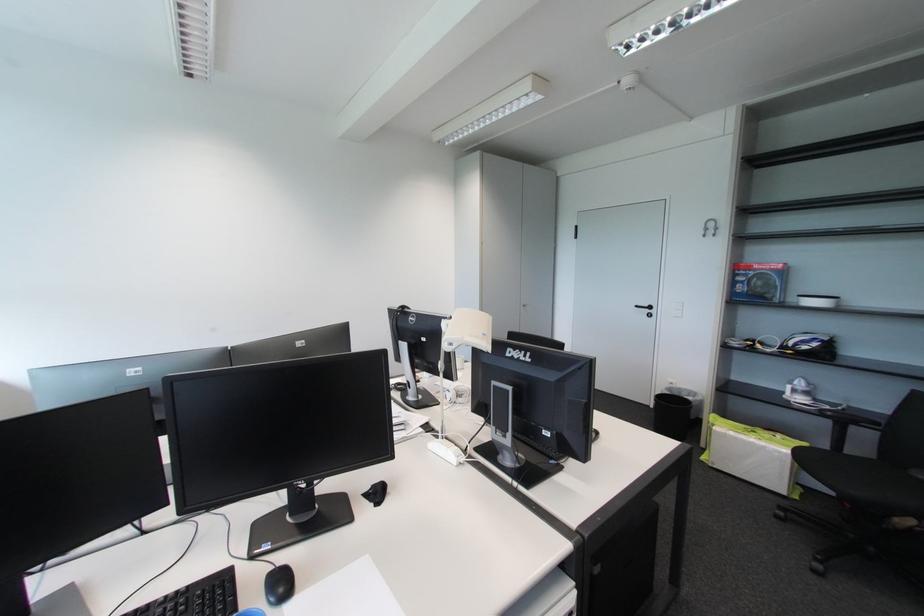
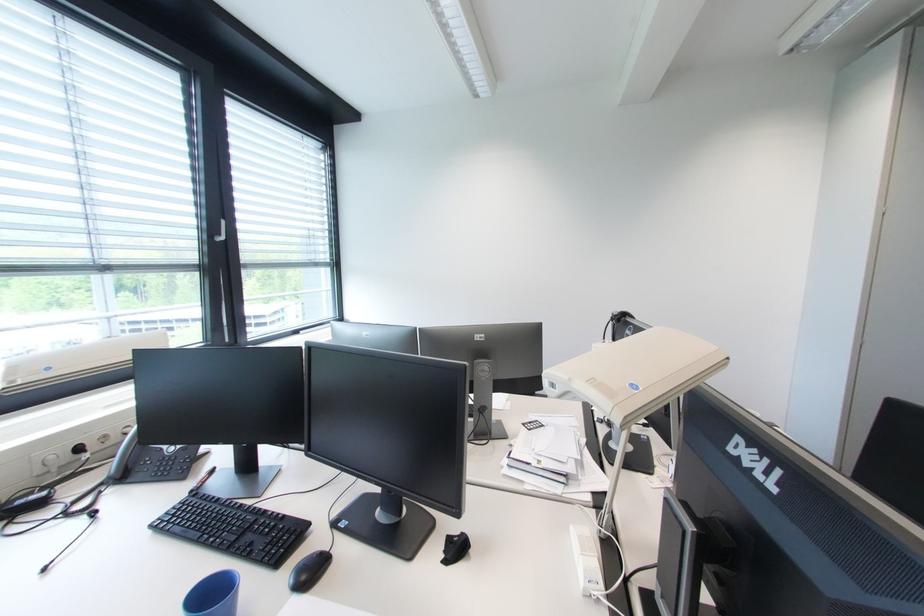
Question: How did the camera likely rotate?

Choices:
 (A) Left
 (B) Right
 (C) Up
 (D) Down

Answer: (A)